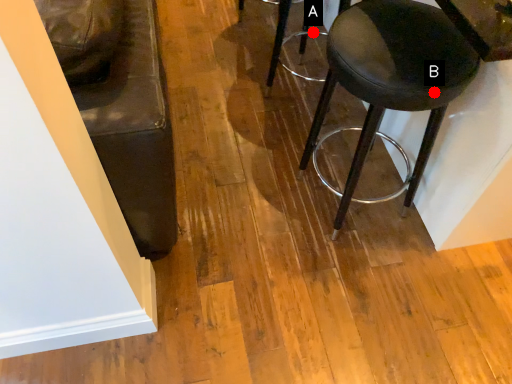
Question: Two points are circled on the image, labeled by A and B beside each circle. Among these points, which one is nearest to the camera?

Choices:
 (A) A is closer
 (B) B is closer

Answer: (B)